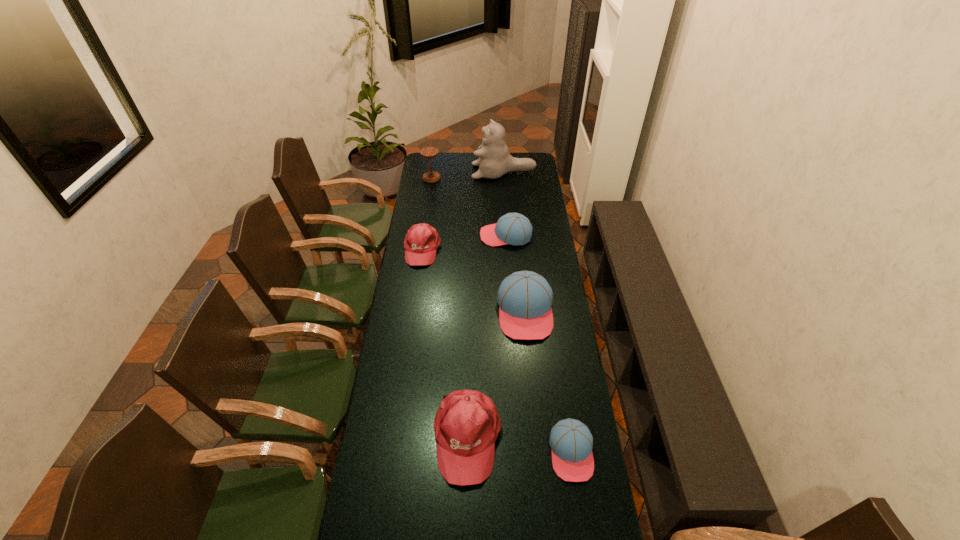
Find the location of a particular element. Image resolution: width=960 pixels, height=540 pixels. vacant space at the left edge of the desktop is located at coordinates (417, 288).

Locate an element on the screen. This screenshot has height=540, width=960. vacant area at the right edge of the desktop is located at coordinates (602, 496).

The height and width of the screenshot is (540, 960). Identify the location of empty space between the smallest blue baseball cap and the second nearest blue baseball cap. (548, 382).

This screenshot has height=540, width=960. I want to click on empty location between the third farthest baseball cap and the nearest blue baseball cap, so click(548, 382).

At what (x,y) coordinates should I click in order to perform the action: click on free space between the biggest blue baseball cap and the hourglass. Please return your answer as a coordinate pair (x, y). The height and width of the screenshot is (540, 960). Looking at the image, I should click on (478, 245).

You are a GUI agent. You are given a task and a screenshot of the screen. Output one action in this format:
    pyautogui.click(x=<x>, y=<y>)
    Task: Click on the unoccupied position between the smaller red baseball cap and the shortest object
    The image size is (960, 540).
    Given the screenshot: What is the action you would take?
    pyautogui.click(x=497, y=351)

You are a GUI agent. You are given a task and a screenshot of the screen. Output one action in this format:
    pyautogui.click(x=<x>, y=<y>)
    Task: Click on the free area in between the second biggest blue baseball cap and the shortest baseball cap
    Image resolution: width=960 pixels, height=540 pixels.
    Given the screenshot: What is the action you would take?
    pyautogui.click(x=539, y=344)

This screenshot has height=540, width=960. In order to click on empty location between the second smallest blue baseball cap and the hourglass in this screenshot , I will do `click(468, 207)`.

Where is `blank region between the farthest blue baseball cap and the right red baseball cap`? The image size is (960, 540). blank region between the farthest blue baseball cap and the right red baseball cap is located at coordinates click(487, 336).

This screenshot has width=960, height=540. I want to click on the second closest object to the bigger red baseball cap, so click(x=525, y=298).